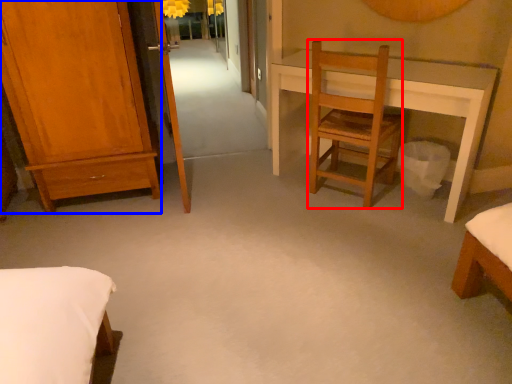
Question: Which object is further to the camera taking this photo, chair (highlighted by a red box) or furniture (highlighted by a blue box)?

Choices:
 (A) chair
 (B) furniture

Answer: (A)